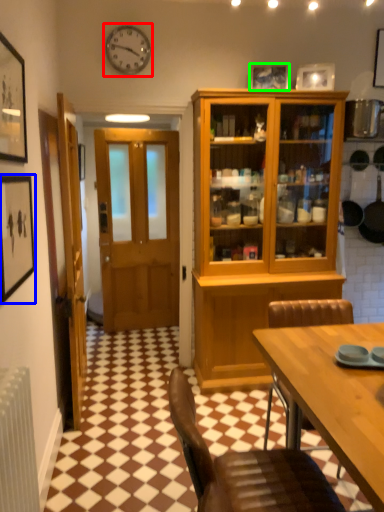
Question: Considering the real-world distances, which object is closest to clock (highlighted by a red box)? picture frame (highlighted by a blue box) or picture frame (highlighted by a green box).

Choices:
 (A) picture frame
 (B) picture frame

Answer: (B)